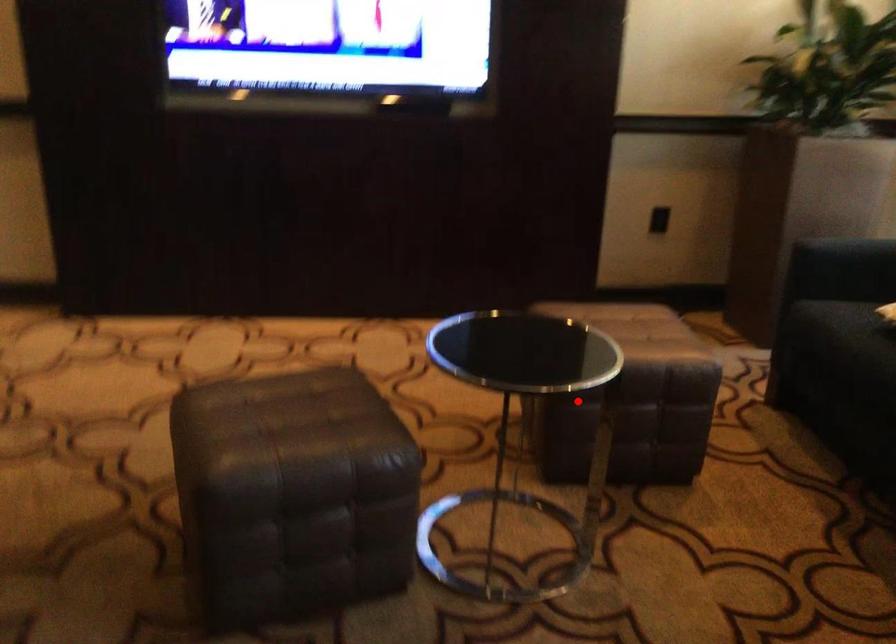
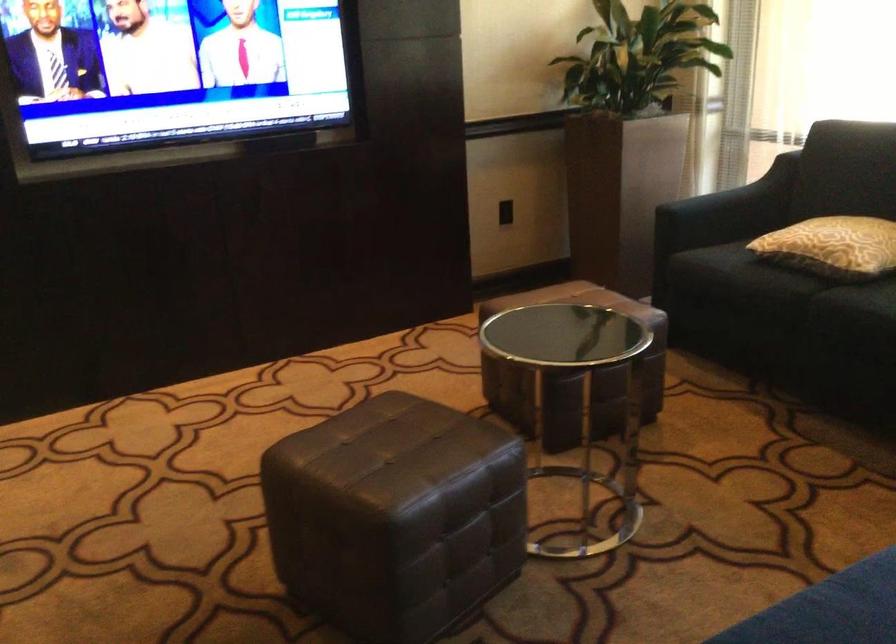
Question: I am providing you with two images of the same scene from different viewpoints. A red point is shown in image1. For the corresponding object point in image2, is it positioned nearer or farther from the camera?

Choices:
 (A) Nearer
 (B) Farther

Answer: (B)